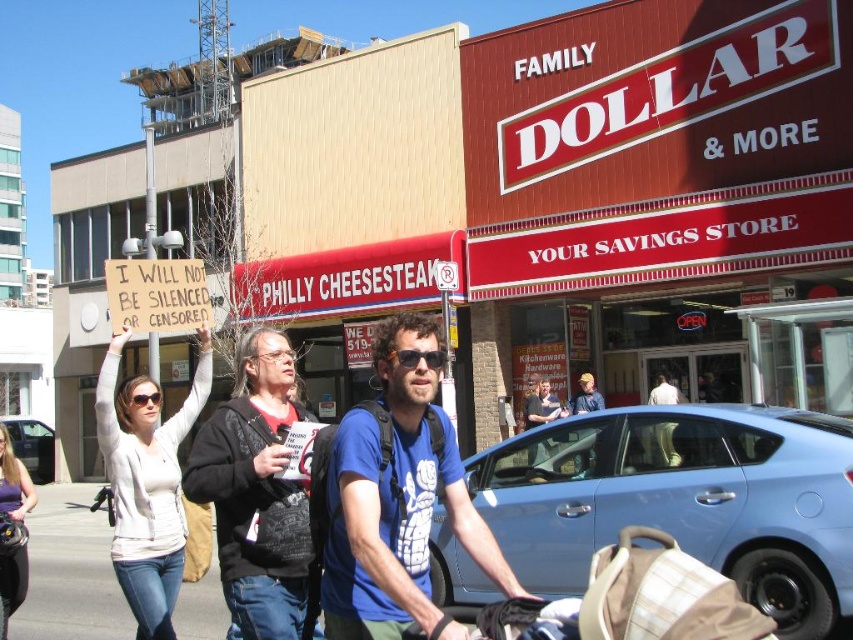
Between dark gray hoodie at center and white cotton shirt at center, which one has less height?

white cotton shirt at center is shorter.

Which of these two, dark gray hoodie at center or white cotton shirt at center, stands taller?

Standing taller between the two is dark gray hoodie at center.

At what (x,y) coordinates should I click in order to perform the action: click on dark gray hoodie at center. Please return your answer as a coordinate pair (x, y). The width and height of the screenshot is (853, 640). Looking at the image, I should click on (256, 492).

Who is more distant from viewer, [149,506] or [25,461]?

The point [25,461] is more distant.

Between white sweater at center and metallic blue sedan at center, which one is positioned higher?

white sweater at center

Who is more forward, (109,416) or (39,435)?

Point (109,416) is more forward.

The height and width of the screenshot is (640, 853). What are the coordinates of `white sweater at center` in the screenshot? It's located at (146, 483).

Who is lower down, blue matte car at lower right or plaid fabric baby carriage at lower center?

blue matte car at lower right

Between point (643, 413) and point (538, 620), which one is positioned behind?

Positioned behind is point (643, 413).

This screenshot has height=640, width=853. Identify the location of blue matte car at lower right. (683, 500).